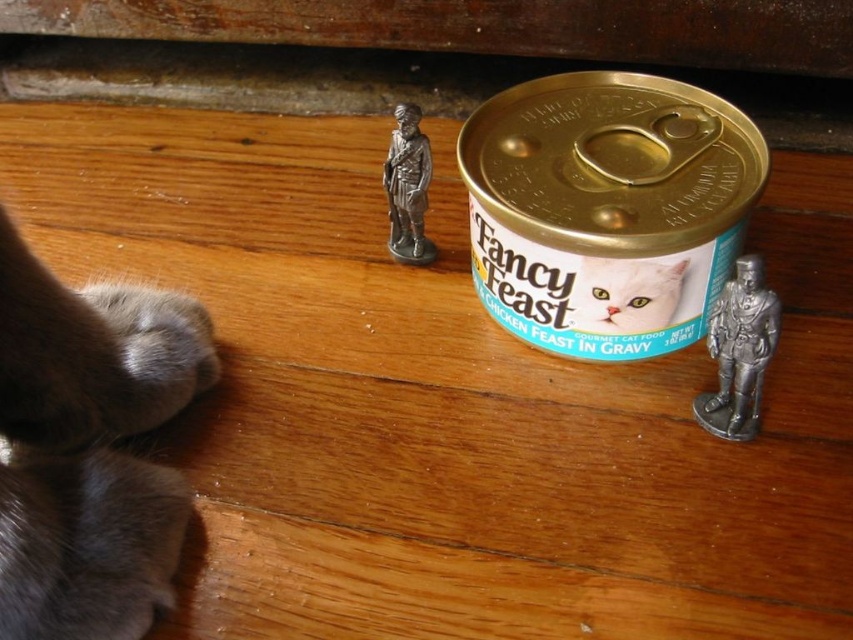
Question: Considering the relative positions of fuzzy fur paw at lower left and metallic figure at center-right in the image provided, where is fuzzy fur paw at lower left located with respect to metallic figure at center-right?

Choices:
 (A) right
 (B) left

Answer: (B)

Question: Among these objects, which one is farthest from the camera?

Choices:
 (A) white glossy cat food can at center
 (B) fuzzy fur paw at lower left
 (C) metallic figure at center-right

Answer: (A)

Question: Which point appears farthest from the camera in this image?

Choices:
 (A) (91, 385)
 (B) (746, 257)

Answer: (A)

Question: Can you confirm if metallic figure at center-right is positioned to the left of white glossy cat food can at center?

Choices:
 (A) no
 (B) yes

Answer: (A)

Question: Which object is closer to the camera taking this photo?

Choices:
 (A) white glossy cat food can at center
 (B) metallic figure at center-right
 (C) fuzzy fur paw at lower left

Answer: (C)

Question: Can you confirm if fuzzy fur paw at lower left is bigger than metallic figure at center-right?

Choices:
 (A) no
 (B) yes

Answer: (B)